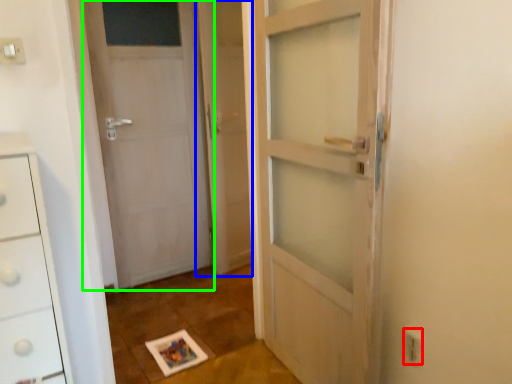
Question: Based on their relative distances, which object is nearer to electric outlet (highlighted by a red box)? Choose from screen door (highlighted by a blue box) and door (highlighted by a green box).

Choices:
 (A) screen door
 (B) door

Answer: (A)